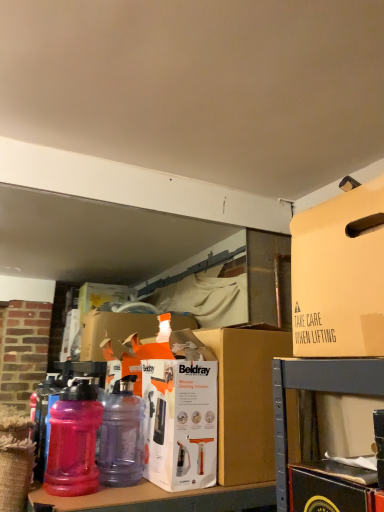
Question: Is pink translucent water bottle at lower left, the 2th bottle viewed from the right, taller than translucent purple bottle at center, which is counted as the 1th bottle, starting from the right?

Choices:
 (A) yes
 (B) no

Answer: (B)

Question: From a real-world perspective, is pink translucent water bottle at lower left, the 1th bottle in the left-to-right sequence, positioned over translucent purple bottle at center, which ranks as the 2th bottle in left-to-right order, based on gravity?

Choices:
 (A) no
 (B) yes

Answer: (B)

Question: Is pink translucent water bottle at lower left, the 1th bottle in the left-to-right sequence, facing towards translucent purple bottle at center, which ranks as the 2th bottle in left-to-right order?

Choices:
 (A) no
 (B) yes

Answer: (A)

Question: Does pink translucent water bottle at lower left, the 2th bottle viewed from the right, touch translucent purple bottle at center, which is counted as the 1th bottle, starting from the right?

Choices:
 (A) yes
 (B) no

Answer: (A)

Question: Is pink translucent water bottle at lower left, the 1th bottle in the left-to-right sequence, far away from translucent purple bottle at center, which ranks as the 2th bottle in left-to-right order?

Choices:
 (A) no
 (B) yes

Answer: (A)

Question: Is pink translucent water bottle at lower left, the 2th bottle viewed from the right, outside of translucent purple bottle at center, which is counted as the 1th bottle, starting from the right?

Choices:
 (A) no
 (B) yes

Answer: (B)

Question: Does translucent purple bottle at center, which is counted as the 1th bottle, starting from the right, touch brown cardboard box at center?

Choices:
 (A) no
 (B) yes

Answer: (A)

Question: From the image's perspective, would you say translucent purple bottle at center, which is counted as the 1th bottle, starting from the right, is shown under brown cardboard box at center?

Choices:
 (A) no
 (B) yes

Answer: (B)

Question: Can brown cardboard box at center be found inside translucent purple bottle at center, which is counted as the 1th bottle, starting from the right?

Choices:
 (A) no
 (B) yes

Answer: (A)

Question: From the image's perspective, is translucent purple bottle at center, which is counted as the 1th bottle, starting from the right, on top of brown cardboard box at center?

Choices:
 (A) yes
 (B) no

Answer: (B)

Question: From a real-world perspective, is translucent purple bottle at center, which is counted as the 1th bottle, starting from the right, beneath brown cardboard box at center?

Choices:
 (A) yes
 (B) no

Answer: (A)

Question: Does translucent purple bottle at center, which is counted as the 1th bottle, starting from the right, have a larger size compared to brown cardboard box at center?

Choices:
 (A) no
 (B) yes

Answer: (A)

Question: Is brown cardboard box at center not within translucent purple bottle at center, which is counted as the 1th bottle, starting from the right?

Choices:
 (A) no
 (B) yes

Answer: (B)